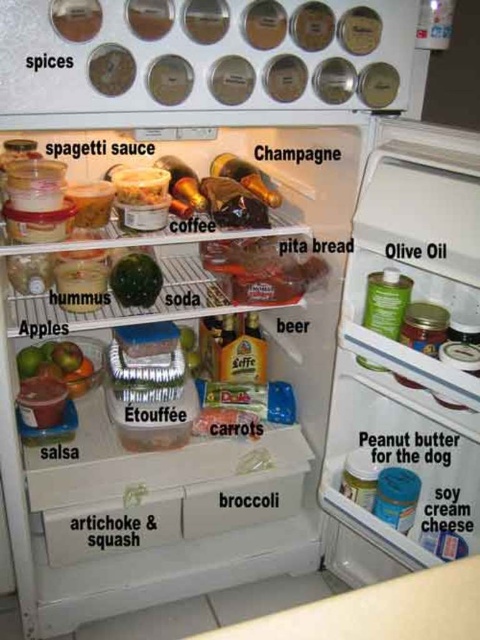
Question: Is green matte apples at lower left to the left of green matte watermelon at center from the viewer's perspective?

Choices:
 (A) yes
 (B) no

Answer: (A)

Question: Which object appears farthest from the camera in this image?

Choices:
 (A) green matte watermelon at center
 (B) green matte apples at lower left

Answer: (B)

Question: From the image, what is the correct spatial relationship of green matte apples at lower left in relation to green matte watermelon at center?

Choices:
 (A) below
 (B) above

Answer: (A)

Question: Which point is farther to the camera?

Choices:
 (A) green matte watermelon at center
 (B) green matte apples at lower left

Answer: (B)

Question: From the image, what is the correct spatial relationship of green matte apples at lower left in relation to green matte watermelon at center?

Choices:
 (A) right
 (B) left

Answer: (B)